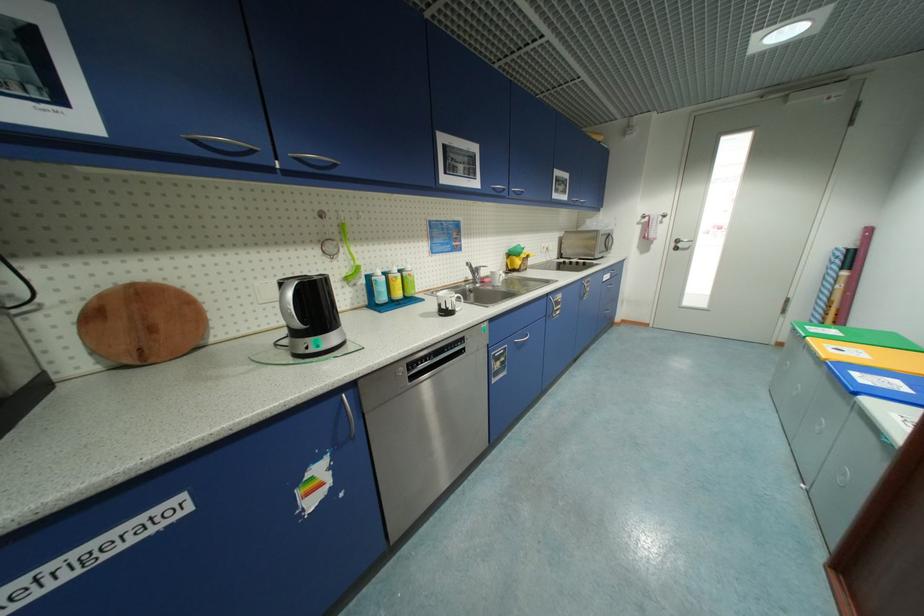
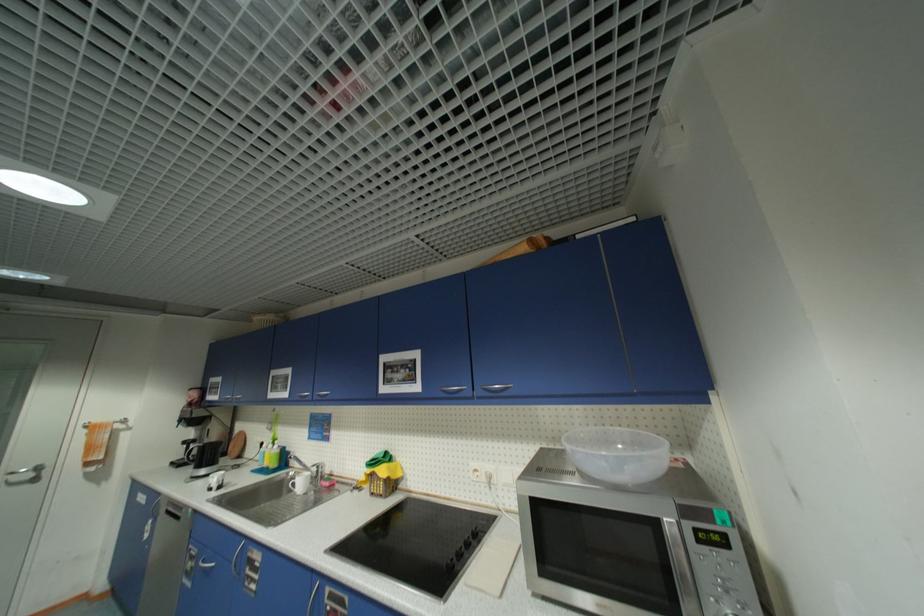
Locate, in the second image, the point that corresponds to (x=504, y=365) in the first image.

(196, 565)